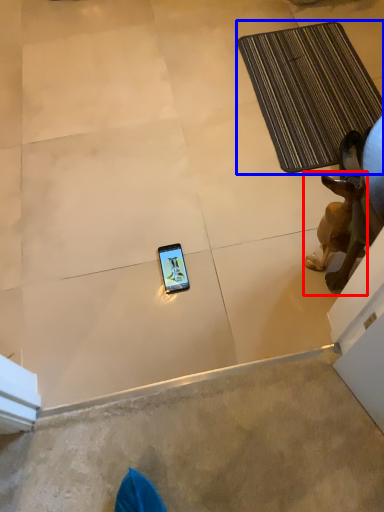
Question: Which object is further to the camera taking this photo, dog (highlighted by a red box) or bath mat (highlighted by a blue box)?

Choices:
 (A) dog
 (B) bath mat

Answer: (B)